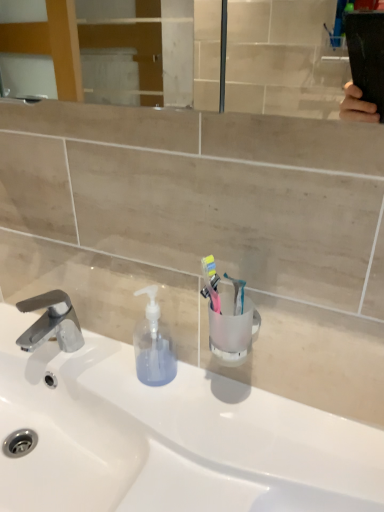
Find the location of a particular element. This screenshot has height=512, width=384. vacant area located to the right-hand side of transparent plastic soap dispenser at center is located at coordinates (229, 401).